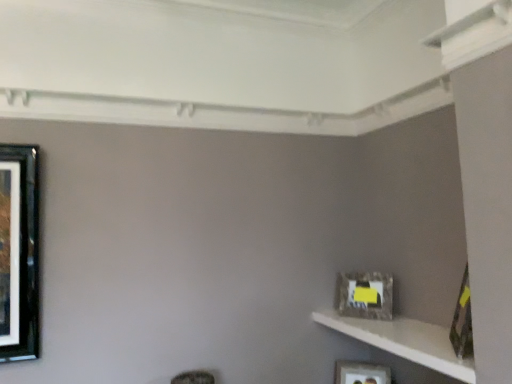
The width and height of the screenshot is (512, 384). What do you see at coordinates (364, 295) in the screenshot?
I see `matte gray frame at right, the 2th picture frame from the bottom` at bounding box center [364, 295].

Measure the distance between point (444,354) and camera.

They are 5.64 feet apart.

Locate an element on the screen. This screenshot has height=384, width=512. white textured shelf at lower right is located at coordinates (404, 341).

The image size is (512, 384). Describe the element at coordinates (361, 373) in the screenshot. I see `matte black picture frame at lower right, which is the third picture frame from front to back` at that location.

At what (x,y) coordinates should I click in order to perform the action: click on matte gray frame at right, placed as the 2th picture frame when sorted from front to back. Please return your answer as a coordinate pair (x, y). Image resolution: width=512 pixels, height=384 pixels. Looking at the image, I should click on (364, 295).

Does camouflage-patterned frame at right, which is the third picture frame in bottom-to-top order, lie in front of matte black picture frame at lower right, which is the third picture frame from front to back?

Yes, camouflage-patterned frame at right, which is the third picture frame in bottom-to-top order, is closer to the viewer.

Who is shorter, camouflage-patterned frame at right, which is counted as the first picture frame, starting from the top, or matte black picture frame at lower right, the 1th picture frame in the bottom-to-top sequence?

With less height is matte black picture frame at lower right, the 1th picture frame in the bottom-to-top sequence.

Is camouflage-patterned frame at right, placed as the third picture frame when sorted from back to front, surrounding matte black picture frame at lower right, acting as the third picture frame starting from the top?

Definitely not — matte black picture frame at lower right, acting as the third picture frame starting from the top, is not inside camouflage-patterned frame at right, placed as the third picture frame when sorted from back to front.

Can you confirm if matte gray frame at right, the 2th picture frame from the bottom, is shorter than camouflage-patterned frame at right, the 1th picture frame when ordered from front to back?

Indeed, matte gray frame at right, the 2th picture frame from the bottom, has a lesser height compared to camouflage-patterned frame at right, the 1th picture frame when ordered from front to back.

Between matte gray frame at right, which is the 2th picture frame from back to front, and camouflage-patterned frame at right, which is the third picture frame in bottom-to-top order, which one is positioned in front?

camouflage-patterned frame at right, which is the third picture frame in bottom-to-top order, is closer to the camera.

How different are the orientations of matte gray frame at right, placed as the 2th picture frame when sorted from front to back, and camouflage-patterned frame at right, placed as the third picture frame when sorted from back to front, in degrees?

matte gray frame at right, placed as the 2th picture frame when sorted from front to back, and camouflage-patterned frame at right, placed as the third picture frame when sorted from back to front, are facing 74.7 degrees away from each other.

From a real-world perspective, is matte gray frame at right, placed as the 2th picture frame when sorted from front to back, positioned above or below camouflage-patterned frame at right, placed as the third picture frame when sorted from back to front?

Clearly, from a real-world perspective, matte gray frame at right, placed as the 2th picture frame when sorted from front to back, is below camouflage-patterned frame at right, placed as the third picture frame when sorted from back to front.

Can you confirm if camouflage-patterned frame at right, the 1th picture frame when ordered from front to back, is shorter than white textured shelf at lower right?

Incorrect, the height of camouflage-patterned frame at right, the 1th picture frame when ordered from front to back, does not fall short of that of white textured shelf at lower right.

From a real-world perspective, relative to white textured shelf at lower right, is camouflage-patterned frame at right, placed as the third picture frame when sorted from back to front, vertically above or below?

Clearly, from a real-world perspective, camouflage-patterned frame at right, placed as the third picture frame when sorted from back to front, is above white textured shelf at lower right.

Is camouflage-patterned frame at right, which is counted as the first picture frame, starting from the top, with white textured shelf at lower right?

camouflage-patterned frame at right, which is counted as the first picture frame, starting from the top, and white textured shelf at lower right are not in contact.

Which object is further away from the camera, camouflage-patterned frame at right, which is counted as the first picture frame, starting from the top, or white textured shelf at lower right?

camouflage-patterned frame at right, which is counted as the first picture frame, starting from the top, is behind.

Based on their sizes in the image, would you say matte black picture frame at lower right, the 1th picture frame in the bottom-to-top sequence, is bigger or smaller than white textured shelf at lower right?

In the image, matte black picture frame at lower right, the 1th picture frame in the bottom-to-top sequence, appears to be smaller than white textured shelf at lower right.

How different are the orientations of matte black picture frame at lower right, acting as the third picture frame starting from the top, and white textured shelf at lower right in degrees?

42.9 degrees.

Consider the image. Considering the relative sizes of matte black picture frame at lower right, the 1th picture frame in the back-to-front sequence, and white textured shelf at lower right in the image provided, is matte black picture frame at lower right, the 1th picture frame in the back-to-front sequence, taller than white textured shelf at lower right?

Indeed, matte black picture frame at lower right, the 1th picture frame in the back-to-front sequence, has a greater height compared to white textured shelf at lower right.

In terms of width, does matte black picture frame at lower right, which is the third picture frame from front to back, look wider or thinner when compared to white textured shelf at lower right?

Clearly, matte black picture frame at lower right, which is the third picture frame from front to back, has less width compared to white textured shelf at lower right.

In terms of width, does matte black picture frame at lower right, the 1th picture frame in the bottom-to-top sequence, look wider or thinner when compared to camouflage-patterned frame at right, which is the third picture frame in bottom-to-top order?

matte black picture frame at lower right, the 1th picture frame in the bottom-to-top sequence, is wider than camouflage-patterned frame at right, which is the third picture frame in bottom-to-top order.

Is matte black picture frame at lower right, which is the third picture frame from front to back, facing towards camouflage-patterned frame at right, which is the third picture frame in bottom-to-top order?

No, matte black picture frame at lower right, which is the third picture frame from front to back, does not turn towards camouflage-patterned frame at right, which is the third picture frame in bottom-to-top order.

Find the location of a particular element. the 2nd picture frame directly above the matte black picture frame at lower right, the 1th picture frame in the back-to-front sequence (from a real-world perspective) is located at coordinates (462, 321).

Is point (337, 382) behind point (464, 357)?

Yes, point (337, 382) is behind point (464, 357).

Does white textured shelf at lower right touch matte gray frame at right, placed as the 2th picture frame when sorted from front to back?

No, white textured shelf at lower right is not touching matte gray frame at right, placed as the 2th picture frame when sorted from front to back.

Could matte gray frame at right, which is the second picture frame in top-to-bottom order, be considered to be inside white textured shelf at lower right?

No.

Between white textured shelf at lower right and matte gray frame at right, placed as the 2th picture frame when sorted from front to back, which one has smaller width?

With smaller width is matte gray frame at right, placed as the 2th picture frame when sorted from front to back.

Is white textured shelf at lower right oriented away from matte gray frame at right, placed as the 2th picture frame when sorted from front to back?

No, white textured shelf at lower right is not facing away from matte gray frame at right, placed as the 2th picture frame when sorted from front to back.

Is there a large distance between matte gray frame at right, which is the second picture frame in top-to-bottom order, and matte black picture frame at lower right, the 1th picture frame in the back-to-front sequence?

They are positioned close to each other.

Looking at this image, which object is more forward, matte gray frame at right, which is the 2th picture frame from back to front, or matte black picture frame at lower right, which is the third picture frame from front to back?

matte gray frame at right, which is the 2th picture frame from back to front, is more forward.

This screenshot has width=512, height=384. Find the location of `picture frame that is the 2nd one when counting backward from the camouflage-patterned frame at right, which is counted as the first picture frame, starting from the top`. picture frame that is the 2nd one when counting backward from the camouflage-patterned frame at right, which is counted as the first picture frame, starting from the top is located at coordinates (361, 373).

Locate an element on the screen. This screenshot has width=512, height=384. picture frame lying on the right of matte gray frame at right, which is the 2th picture frame from back to front is located at coordinates (462, 321).

Looking at the image, which one is located closer to white textured shelf at lower right, matte gray frame at right, which is the second picture frame in top-to-bottom order, or camouflage-patterned frame at right, which is counted as the first picture frame, starting from the top?

matte gray frame at right, which is the second picture frame in top-to-bottom order.

Considering their positions, is matte black picture frame at lower right, the 1th picture frame in the back-to-front sequence, positioned closer to camouflage-patterned frame at right, which is the third picture frame in bottom-to-top order, than white textured shelf at lower right?

Among the two, white textured shelf at lower right is located nearer to camouflage-patterned frame at right, which is the third picture frame in bottom-to-top order.

Considering their positions, is white textured shelf at lower right positioned further to matte black picture frame at lower right, the 1th picture frame in the bottom-to-top sequence, than matte gray frame at right, which is the 2th picture frame from back to front?

white textured shelf at lower right is positioned further to the anchor matte black picture frame at lower right, the 1th picture frame in the bottom-to-top sequence.

Based on their spatial positions, is matte black picture frame at lower right, the 1th picture frame in the back-to-front sequence, or matte gray frame at right, which is the 2th picture frame from back to front, further from white textured shelf at lower right?

matte black picture frame at lower right, the 1th picture frame in the back-to-front sequence, lies further to white textured shelf at lower right than the other object.

Considering their positions, is matte black picture frame at lower right, the 1th picture frame in the back-to-front sequence, positioned further to white textured shelf at lower right than camouflage-patterned frame at right, the 1th picture frame when ordered from front to back?

The object further to white textured shelf at lower right is matte black picture frame at lower right, the 1th picture frame in the back-to-front sequence.

When comparing their distances from camouflage-patterned frame at right, which is counted as the first picture frame, starting from the top, does matte black picture frame at lower right, the 1th picture frame in the back-to-front sequence, or matte gray frame at right, the 2th picture frame from the bottom, seem closer?

matte gray frame at right, the 2th picture frame from the bottom, is positioned closer to the anchor camouflage-patterned frame at right, which is counted as the first picture frame, starting from the top.

Estimate the real-world distances between objects in this image. Which object is closer to matte black picture frame at lower right, the 1th picture frame in the bottom-to-top sequence, camouflage-patterned frame at right, which is the third picture frame in bottom-to-top order, or white textured shelf at lower right?

white textured shelf at lower right is closer to matte black picture frame at lower right, the 1th picture frame in the bottom-to-top sequence.

Estimate the real-world distances between objects in this image. Which object is closer to matte gray frame at right, placed as the 2th picture frame when sorted from front to back, white textured shelf at lower right or camouflage-patterned frame at right, which is counted as the first picture frame, starting from the top?

Based on the image, white textured shelf at lower right appears to be nearer to matte gray frame at right, placed as the 2th picture frame when sorted from front to back.

Where is `picture frame between white textured shelf at lower right and matte gray frame at right, placed as the 2th picture frame when sorted from front to back, in the front-back direction`? The width and height of the screenshot is (512, 384). picture frame between white textured shelf at lower right and matte gray frame at right, placed as the 2th picture frame when sorted from front to back, in the front-back direction is located at coordinates (462, 321).

You are a GUI agent. You are given a task and a screenshot of the screen. Output one action in this format:
    pyautogui.click(x=<x>, y=<y>)
    Task: Click on the picture frame between camouflage-patterned frame at right, placed as the third picture frame when sorted from back to front, and matte black picture frame at lower right, the 1th picture frame in the bottom-to-top sequence, in the front-back direction
    This screenshot has height=384, width=512.
    Given the screenshot: What is the action you would take?
    pyautogui.click(x=364, y=295)